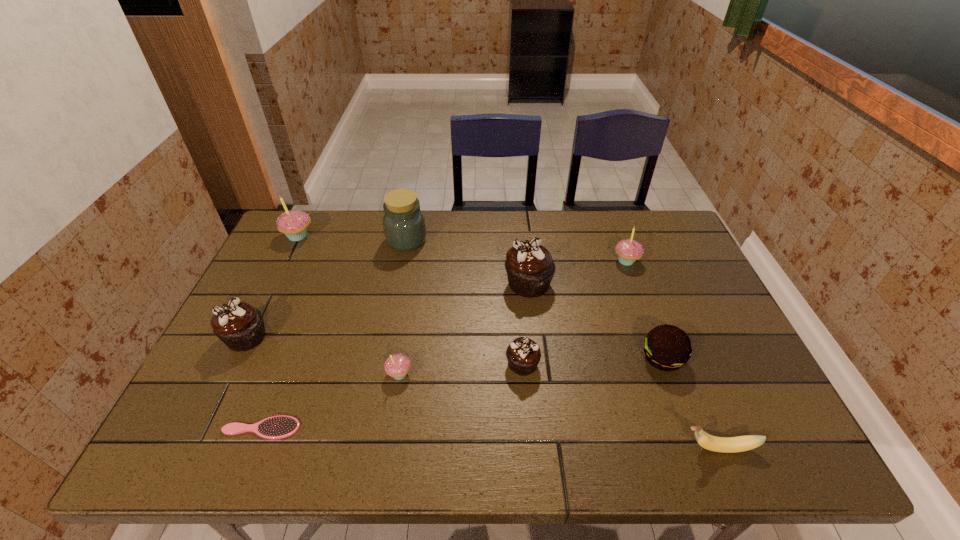
This screenshot has width=960, height=540. Identify the location of unoccupied position between the patty and the green jar. (535, 299).

Identify the location of free space that is in between the smallest brown cupcake and the jar. (465, 302).

Where is `object that stands as the third closest to the biggest pink cupcake`? object that stands as the third closest to the biggest pink cupcake is located at coordinates (397, 366).

Locate which object ranks second in proximity to the biggest brown cupcake. Please provide its 2D coordinates. Your answer should be formatted as a tuple, i.e. [(x, y)], where the tuple contains the x and y coordinates of a point satisfying the conditions above.

[(628, 250)]

Identify which cupcake is the third closest to the nearest pink cupcake. Please provide its 2D coordinates. Your answer should be formatted as a tuple, i.e. [(x, y)], where the tuple contains the x and y coordinates of a point satisfying the conditions above.

[(240, 326)]

Identify the location of the sixth closest cupcake to the patty. Image resolution: width=960 pixels, height=540 pixels. (294, 223).

Select which brown cupcake is the second closest to the third cupcake from left to right. Please provide its 2D coordinates. Your answer should be formatted as a tuple, i.e. [(x, y)], where the tuple contains the x and y coordinates of a point satisfying the conditions above.

[(530, 268)]

Identify which brown cupcake is located as the second nearest to the leftmost brown cupcake. Please provide its 2D coordinates. Your answer should be formatted as a tuple, i.e. [(x, y)], where the tuple contains the x and y coordinates of a point satisfying the conditions above.

[(530, 268)]

Identify the location of pink cupcake that stands as the closest to the smallest brown cupcake. (397, 366).

Identify which pink cupcake is the third closest to the patty. Please provide its 2D coordinates. Your answer should be formatted as a tuple, i.e. [(x, y)], where the tuple contains the x and y coordinates of a point satisfying the conditions above.

[(294, 223)]